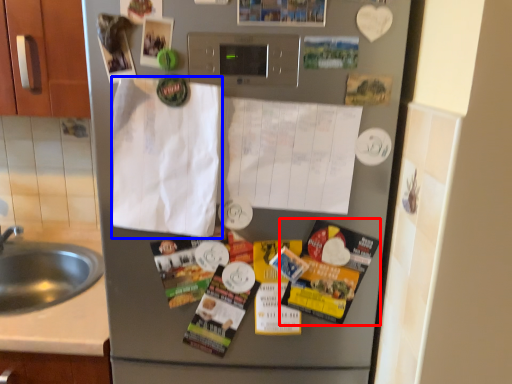
Question: Which of the following is the farthest to the observer, flyer (highlighted by a red box) or envelope (highlighted by a blue box)?

Choices:
 (A) flyer
 (B) envelope

Answer: (A)